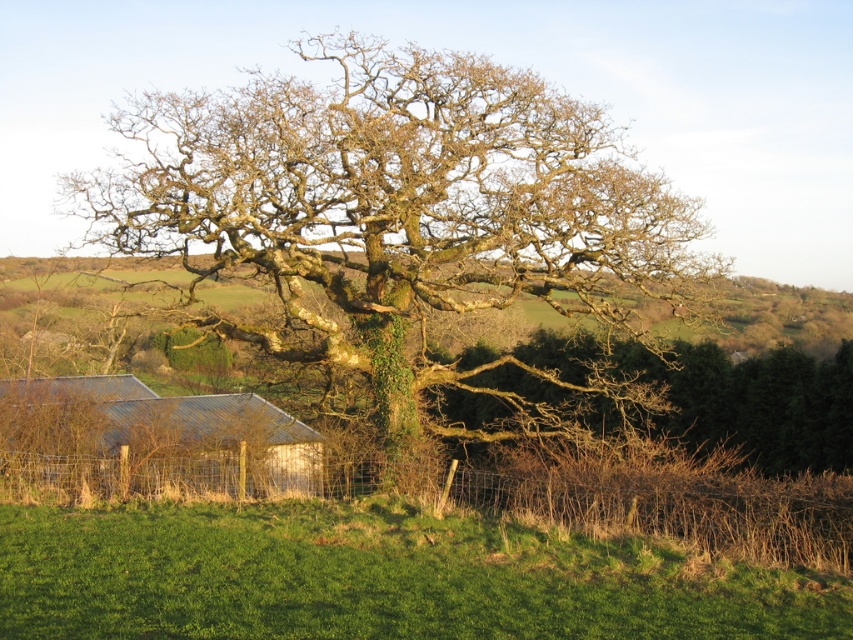
Does point (628, 394) come farther from viewer compared to point (576, 611)?

Yes, point (628, 394) is behind point (576, 611).

Who is higher up, green mossy oak at center or green grassy hill at lower center?

green mossy oak at center is higher up.

Image resolution: width=853 pixels, height=640 pixels. In order to click on green mossy oak at center in this screenshot , I will do `click(404, 220)`.

Is green grassy hill at lower center closer to camera compared to white corrugated metal hut at lower left?

Yes, green grassy hill at lower center is closer to the viewer.

Can you confirm if green grassy hill at lower center is wider than white corrugated metal hut at lower left?

Yes.

Describe the element at coordinates (376, 579) in the screenshot. This screenshot has width=853, height=640. I see `green grassy hill at lower center` at that location.

The width and height of the screenshot is (853, 640). I want to click on green grassy hill at lower center, so [x=376, y=579].

Is green mossy oak at center bigger than white corrugated metal hut at lower left?

Yes.

Does green mossy oak at center appear on the right side of white corrugated metal hut at lower left?

Correct, you'll find green mossy oak at center to the right of white corrugated metal hut at lower left.

Which is in front, point (300, 115) or point (99, 428)?

Point (300, 115) is in front.

The width and height of the screenshot is (853, 640). I want to click on green mossy oak at center, so click(x=404, y=220).